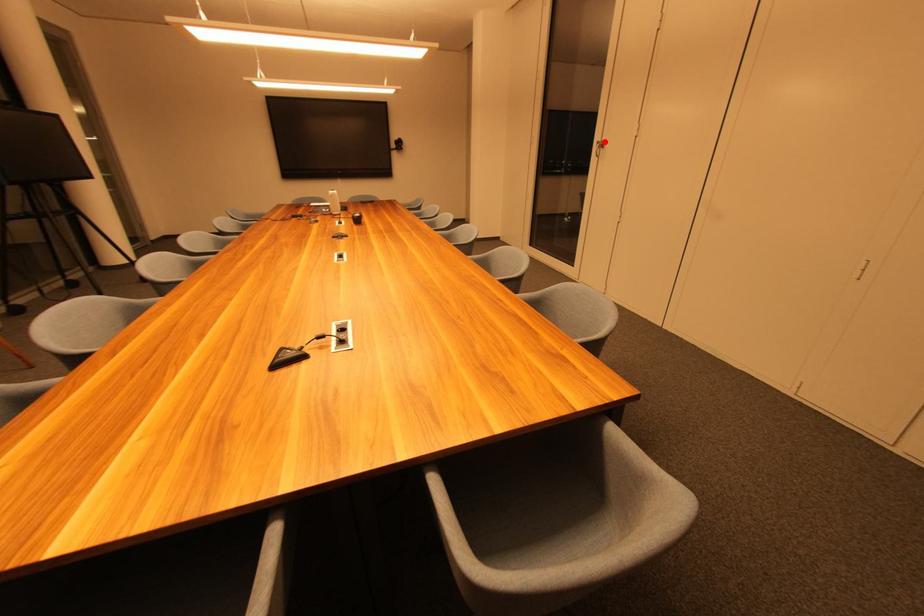
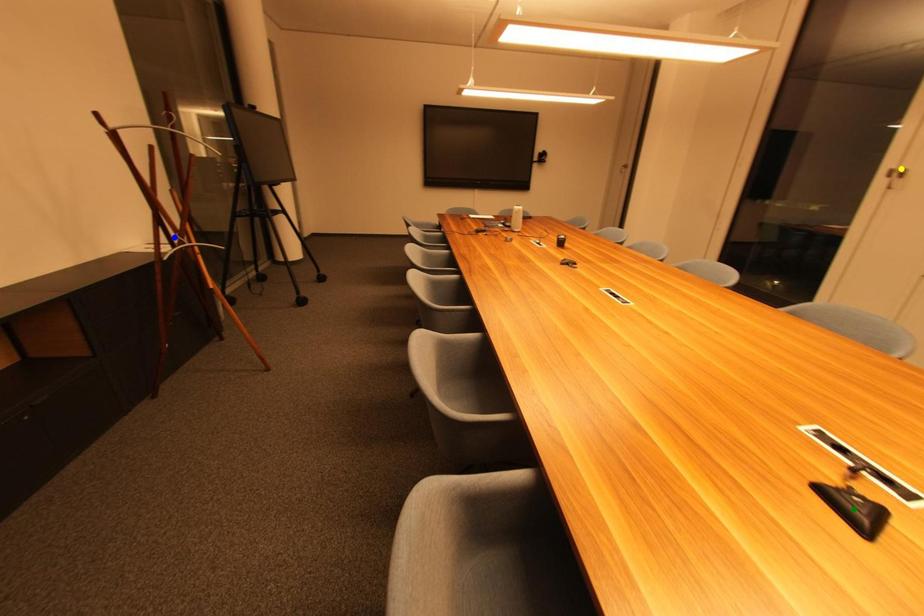
Question: I am providing you with two images of the same scene from different viewpoints. A red point is marked on the first image. You are given multiple points on the second image. Which point in image 2 represents the same 3d spot as the red point in image 1?

Choices:
 (A) green point
 (B) blue point
 (C) yellow point

Answer: (C)